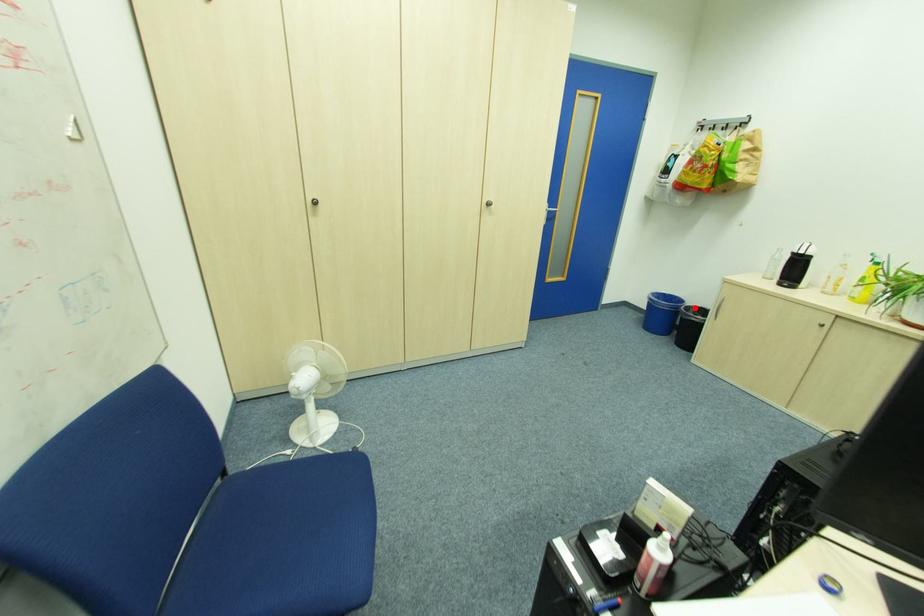
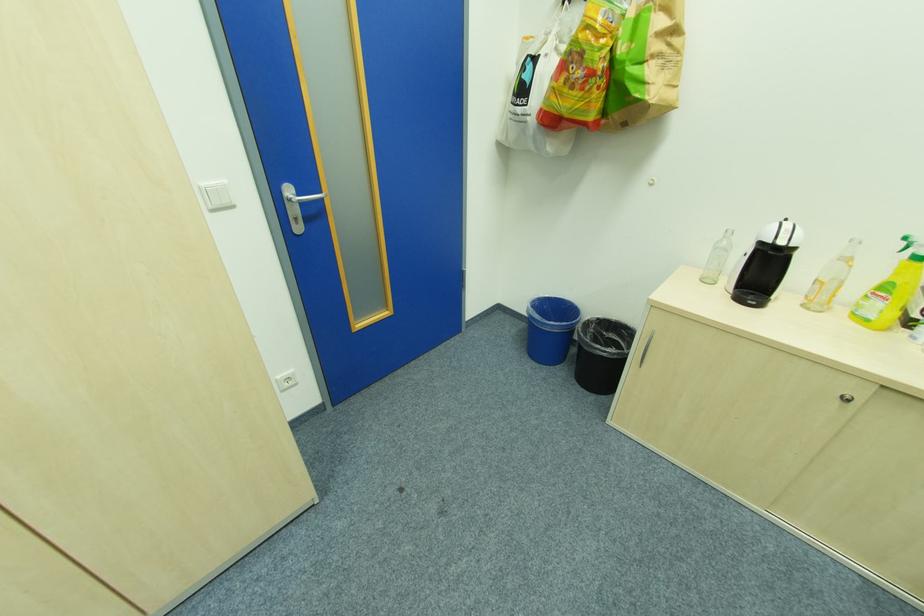
Question: I am providing you with two images of the same scene from different viewpoints. A red point is shown in image1. For the corresponding object point in image2, is it positioned nearer or farther from the camera?

Choices:
 (A) Nearer
 (B) Farther

Answer: (B)